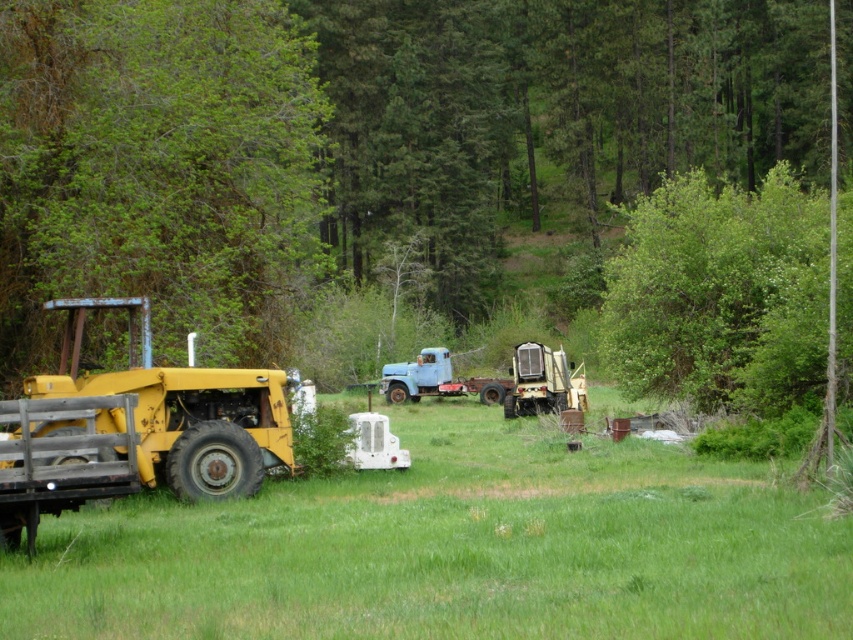
You are a farmer trying to drive your new red tractor through the field. You see the green leafy tree at center and the light blue matte truck at center. Which object is closer to you as you approach the center of the field?

The green leafy tree at center is closer to you than the light blue matte truck at center as you approach the center of the field.

You are a hiker trying to cross the green grassy field at lower left. There is a green leafy tree at center blocking your path. Can you walk around the tree on the left side to reach the other side?

The green leafy tree at center has a larger width than the green grassy field at lower left, so it might be difficult to walk around it on the left side without leaving the field.

You are standing at the point labeled as point (358,141) in the image. What can you see around you?

You are standing on a green leafy tree at center, so you can see the surrounding grassy field, dense greenery like trees and shrubs, and the yellow tractor with a flatbed trailer in the foreground, as well as the blue truck and another yellow tractor in the midground.